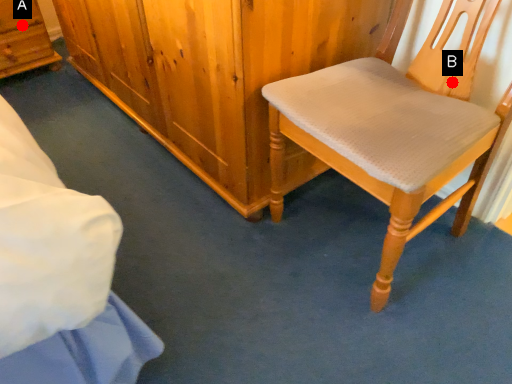
Question: Two points are circled on the image, labeled by A and B beside each circle. Among these points, which one is farthest from the camera?

Choices:
 (A) A is further
 (B) B is further

Answer: (A)